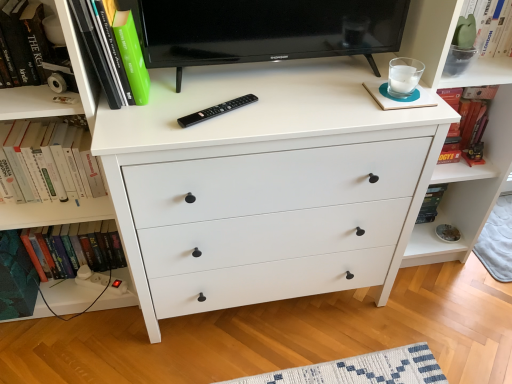
This screenshot has width=512, height=384. In order to click on unoccupied space behind black plastic remote at center in this screenshot , I will do `click(221, 86)`.